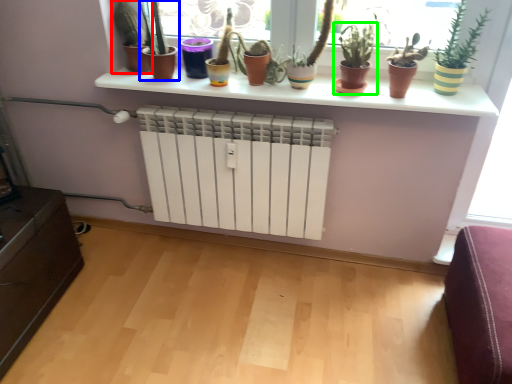
Question: Which object is positioned farthest from houseplant (highlighted by a red box)? Select from houseplant (highlighted by a blue box) and houseplant (highlighted by a green box).

Choices:
 (A) houseplant
 (B) houseplant

Answer: (B)